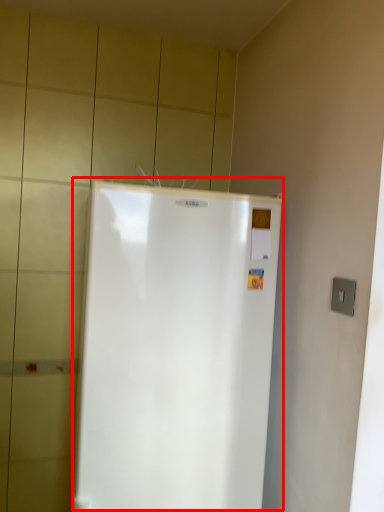
Question: From the image's perspective, where is refrigerator (annotated by the red box) located relative to electric outlet?

Choices:
 (A) above
 (B) below

Answer: (B)